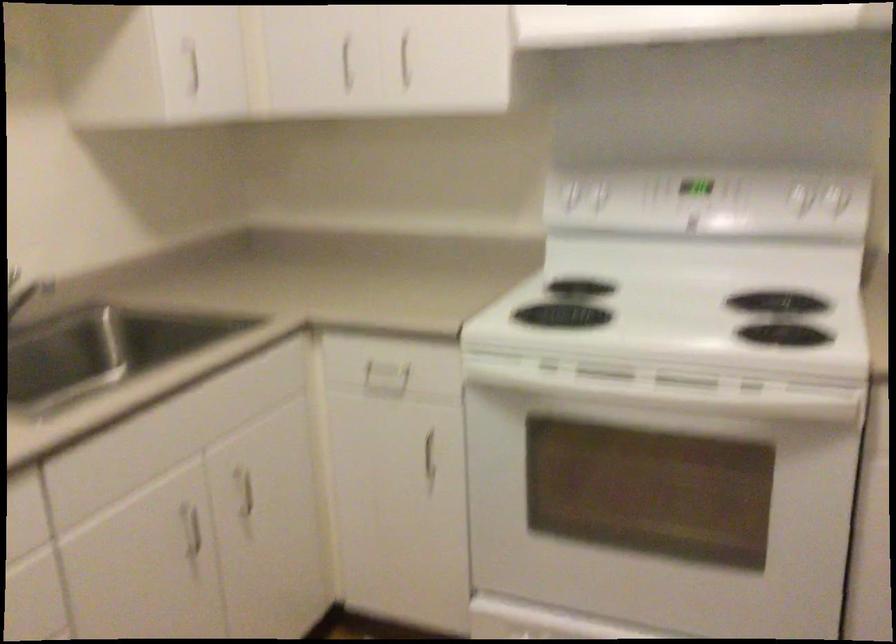
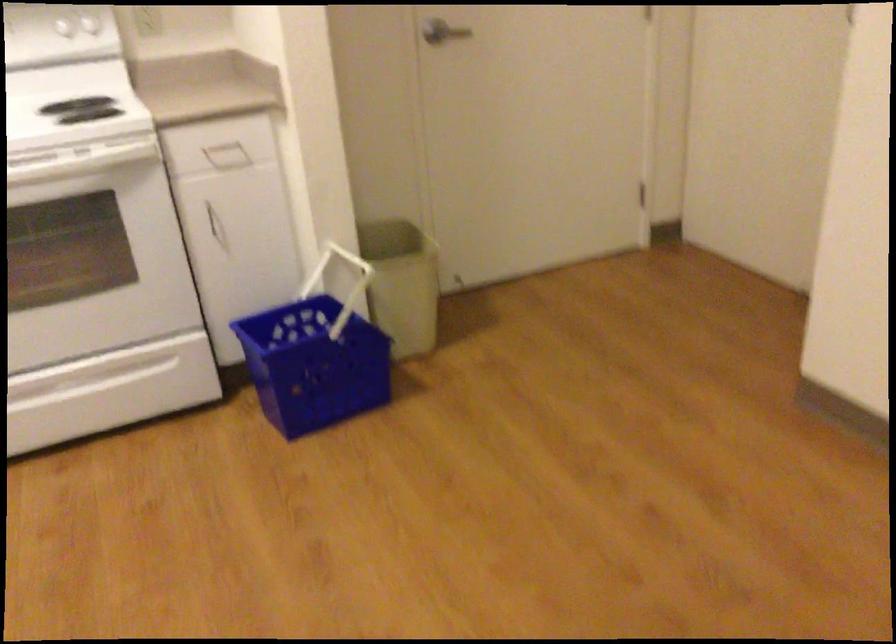
Find the pixel in the second image that matches pixel 821 196 in the first image.

(80, 26)